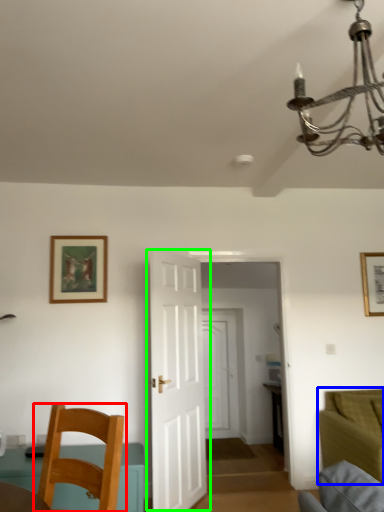
Question: Which is nearer to the chair (highlighted by a red box)? couch (highlighted by a blue box) or door (highlighted by a green box).

Choices:
 (A) couch
 (B) door

Answer: (B)